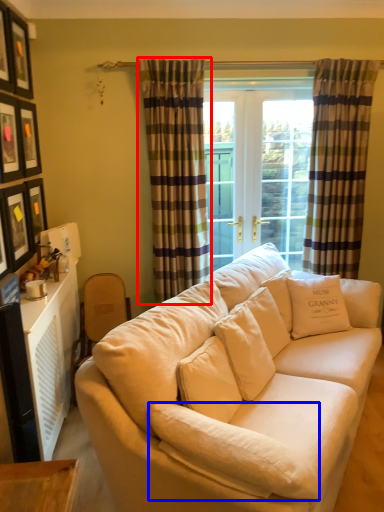
Question: Which object is further to the camera taking this photo, curtain (highlighted by a red box) or pillow (highlighted by a blue box)?

Choices:
 (A) curtain
 (B) pillow

Answer: (A)